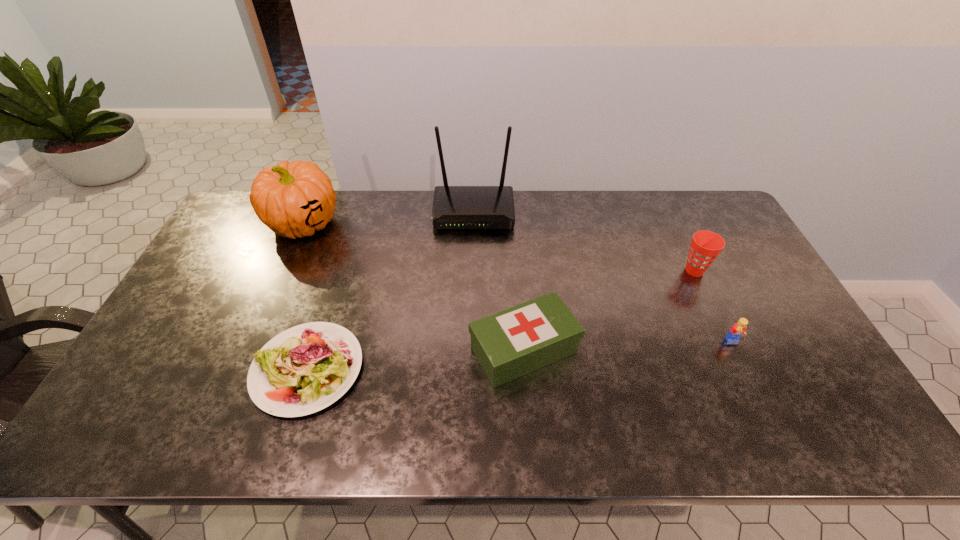
Find the location of a particular element. free region located on the right of the first-aid kit is located at coordinates (685, 350).

Identify the location of vacant space situated on the face of the Lego. (759, 396).

I want to click on vacant region located on the back of the salad plate, so 337,276.

At what (x,y) coordinates should I click in order to perform the action: click on router that is at the far edge. Please return your answer as a coordinate pair (x, y). Looking at the image, I should click on (454, 207).

Find the location of a particular element. This screenshot has width=960, height=540. pumpkin located at the far edge is located at coordinates (295, 199).

The image size is (960, 540). I want to click on object that is at the near edge, so click(304, 369).

The width and height of the screenshot is (960, 540). I want to click on object situated at the left edge, so click(295, 199).

Find the location of `object that is positioned at the right edge`. object that is positioned at the right edge is located at coordinates (705, 246).

Find the location of a particular element. This screenshot has width=960, height=540. object at the far left corner is located at coordinates (295, 199).

At what (x,y) coordinates should I click in order to perform the action: click on free space at the far edge of the desktop. Please return your answer as a coordinate pair (x, y). The width and height of the screenshot is (960, 540). Looking at the image, I should click on (430, 227).